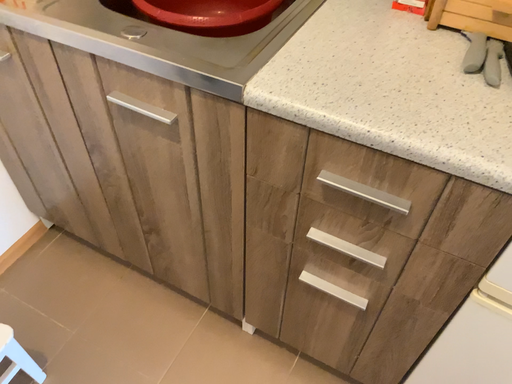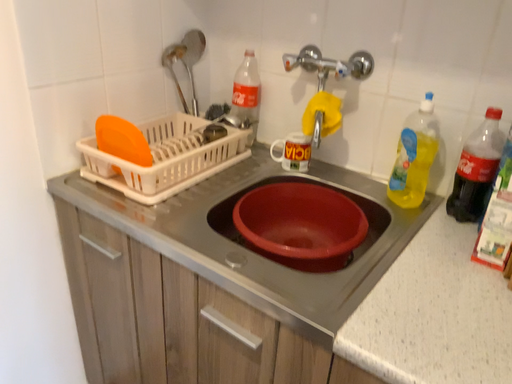
Question: How did the camera likely rotate when shooting the video?

Choices:
 (A) rotated downward
 (B) rotated upward

Answer: (B)